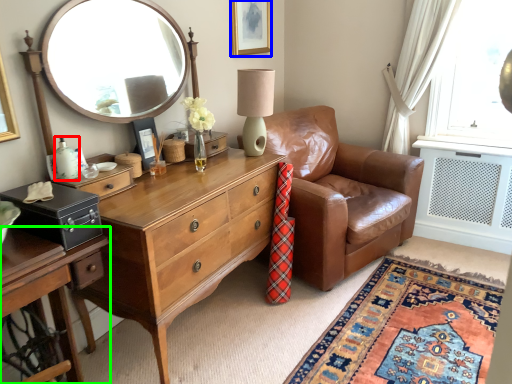
Question: Estimate the real-world distances between objects in this image. Which object is closer to bottle (highlighted by a red box), picture frame (highlighted by a blue box) or cabinetry (highlighted by a green box)?

Choices:
 (A) picture frame
 (B) cabinetry

Answer: (B)